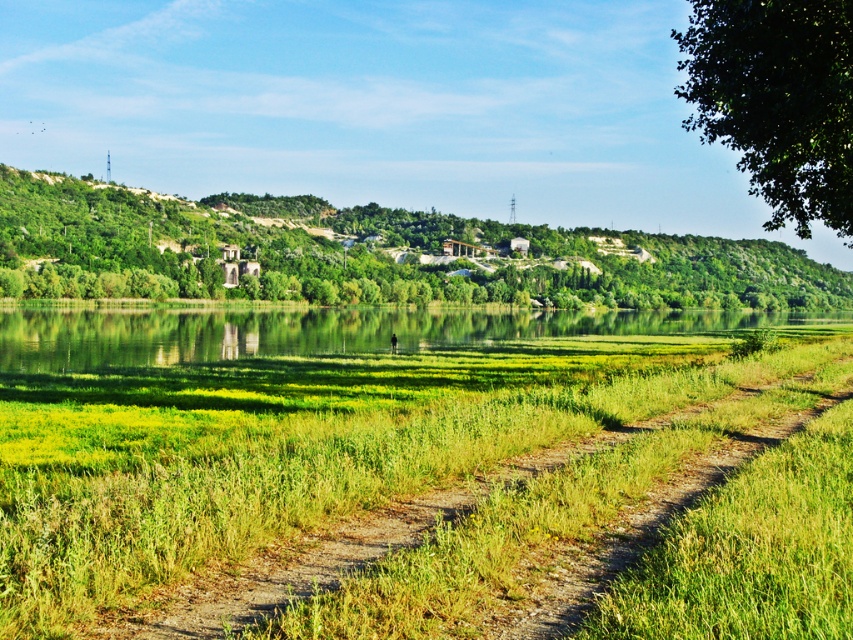
Question: Which object appears farthest from the camera in this image?

Choices:
 (A) green grassy river at center
 (B) green leafy tree at upper right

Answer: (A)

Question: Is green leafy hill at upper center thinner than green grassy river at center?

Choices:
 (A) yes
 (B) no

Answer: (B)

Question: Which point is farther from the camera taking this photo?

Choices:
 (A) (292, 454)
 (B) (670, 269)
 (C) (323, 324)
 (D) (843, 140)

Answer: (B)

Question: Which point is farther from the camera taking this photo?

Choices:
 (A) tap(117, 310)
 (B) tap(344, 292)
 (C) tap(746, 10)

Answer: (B)

Question: Is green grassy river at center to the left of green leafy tree at upper right from the viewer's perspective?

Choices:
 (A) yes
 (B) no

Answer: (A)

Question: Is green grassy at center thinner than green grassy river at center?

Choices:
 (A) no
 (B) yes

Answer: (B)